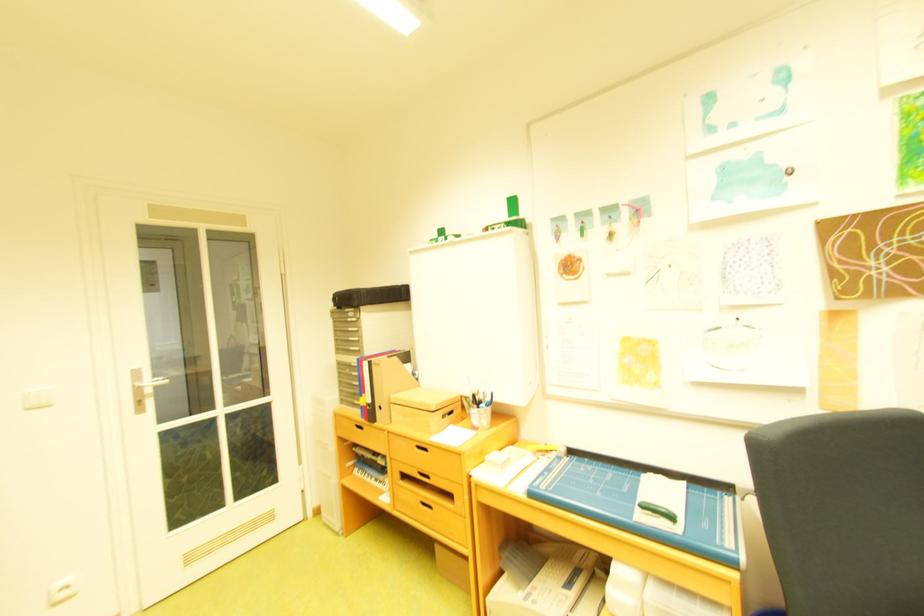
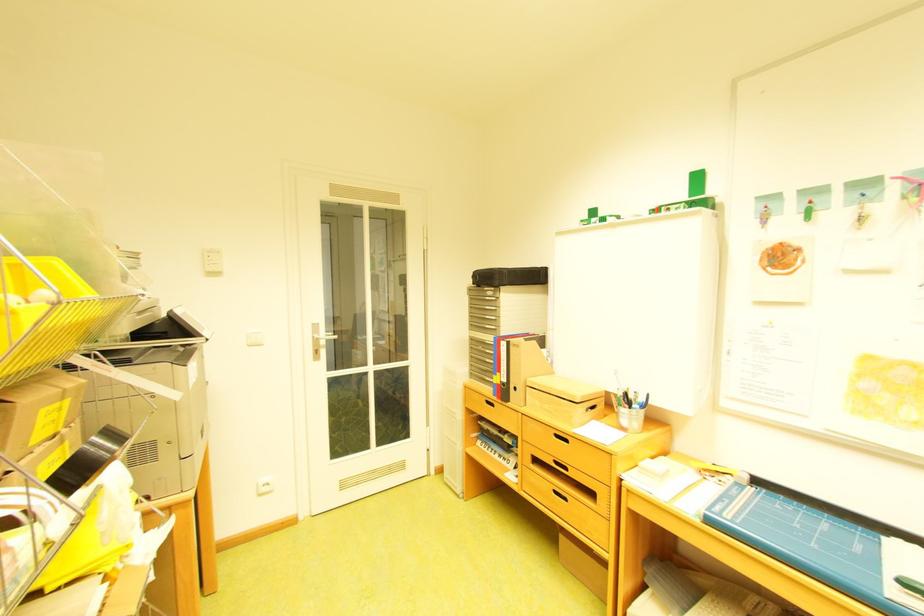
The point at [561,487] is marked in the first image. Where is the corresponding point in the second image?

(747, 517)